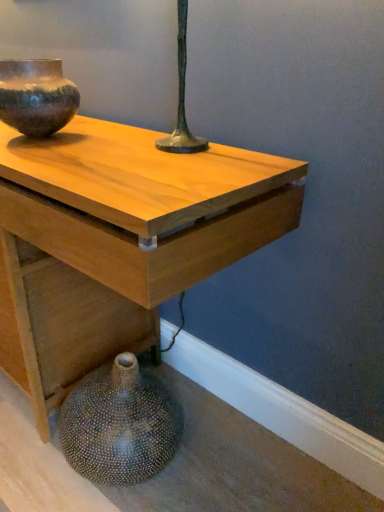
You are a GUI agent. You are given a task and a screenshot of the screen. Output one action in this format:
    pyautogui.click(x=<x>, y=<y>)
    Task: Click on the speckled ceramic vase at lower left, which is the 2th vase from top to bottom
    The image size is (384, 512).
    Given the screenshot: What is the action you would take?
    pyautogui.click(x=120, y=424)

From the image's perspective, is rustic ceramic vase at upper left, positioned as the 1th vase in top-to-bottom order, located above speckled ceramic vase at lower left, the first vase when ordered from bottom to top?

Yes, from the image's perspective, rustic ceramic vase at upper left, positioned as the 1th vase in top-to-bottom order, is above speckled ceramic vase at lower left, the first vase when ordered from bottom to top.

Is rustic ceramic vase at upper left, positioned as the 1th vase in top-to-bottom order, next to speckled ceramic vase at lower left, the first vase when ordered from bottom to top, and touching it?

No, rustic ceramic vase at upper left, positioned as the 1th vase in top-to-bottom order, is not in contact with speckled ceramic vase at lower left, the first vase when ordered from bottom to top.

Which of these two, rustic ceramic vase at upper left, positioned as the 1th vase in top-to-bottom order, or speckled ceramic vase at lower left, which is the 2th vase from top to bottom, is smaller?

rustic ceramic vase at upper left, positioned as the 1th vase in top-to-bottom order, is smaller.

Considering the relative sizes of speckled ceramic vase at lower left, which is the 2th vase from top to bottom, and rustic ceramic vase at upper left, positioned as the 1th vase in top-to-bottom order, in the image provided, is speckled ceramic vase at lower left, which is the 2th vase from top to bottom, bigger than rustic ceramic vase at upper left, positioned as the 1th vase in top-to-bottom order,?

Correct, speckled ceramic vase at lower left, which is the 2th vase from top to bottom, is larger in size than rustic ceramic vase at upper left, positioned as the 1th vase in top-to-bottom order.

Is speckled ceramic vase at lower left, which is the 2th vase from top to bottom, next to rustic ceramic vase at upper left, positioned as the 1th vase in top-to-bottom order?

No, speckled ceramic vase at lower left, which is the 2th vase from top to bottom, is not beside rustic ceramic vase at upper left, positioned as the 1th vase in top-to-bottom order.

Does speckled ceramic vase at lower left, the first vase when ordered from bottom to top, have a greater height compared to rustic ceramic vase at upper left, positioned as the 1th vase in top-to-bottom order?

Indeed, speckled ceramic vase at lower left, the first vase when ordered from bottom to top, has a greater height compared to rustic ceramic vase at upper left, positioned as the 1th vase in top-to-bottom order.

From a real-world perspective, relative to rustic ceramic vase at upper left, marked as the second vase in a bottom-to-top arrangement, is speckled ceramic vase at lower left, which is the 2th vase from top to bottom, vertically above or below?

From a real-world perspective, speckled ceramic vase at lower left, which is the 2th vase from top to bottom, is physically below rustic ceramic vase at upper left, marked as the second vase in a bottom-to-top arrangement.

Where is `the 1st vase counting from the right of the light wood table at center`? the 1st vase counting from the right of the light wood table at center is located at coordinates (36, 96).

From a real-world perspective, is light wood table at center positioned under rustic ceramic vase at upper left, positioned as the 1th vase in top-to-bottom order, based on gravity?

Yes, from a real-world perspective, light wood table at center is beneath rustic ceramic vase at upper left, positioned as the 1th vase in top-to-bottom order.

Based on their positions, is light wood table at center located to the left or right of rustic ceramic vase at upper left, positioned as the 1th vase in top-to-bottom order?

light wood table at center is to the left of rustic ceramic vase at upper left, positioned as the 1th vase in top-to-bottom order.

Does point (96, 353) lie in front of point (19, 126)?

No, (96, 353) is behind (19, 126).

Do you think rustic ceramic vase at upper left, positioned as the 1th vase in top-to-bottom order, is within light wood table at center, or outside of it?

rustic ceramic vase at upper left, positioned as the 1th vase in top-to-bottom order, is outside light wood table at center.

Based on the photo, from the image's perspective, is rustic ceramic vase at upper left, positioned as the 1th vase in top-to-bottom order, positioned above or below light wood table at center?

rustic ceramic vase at upper left, positioned as the 1th vase in top-to-bottom order, is above light wood table at center.

Which object is positioned more to the right, rustic ceramic vase at upper left, positioned as the 1th vase in top-to-bottom order, or light wood table at center?

Positioned to the right is rustic ceramic vase at upper left, positioned as the 1th vase in top-to-bottom order.

Between rustic ceramic vase at upper left, marked as the second vase in a bottom-to-top arrangement, and light wood table at center, which one has larger width?

Wider between the two is light wood table at center.

Consider the image. From the image's perspective, is light wood table at center below speckled ceramic vase at lower left, the first vase when ordered from bottom to top?

Actually, light wood table at center appears above speckled ceramic vase at lower left, the first vase when ordered from bottom to top, in the image.

Considering the sizes of objects light wood table at center and speckled ceramic vase at lower left, which is the 2th vase from top to bottom, in the image provided, who is smaller, light wood table at center or speckled ceramic vase at lower left, which is the 2th vase from top to bottom,?

Smaller between the two is speckled ceramic vase at lower left, which is the 2th vase from top to bottom.

Would you say light wood table at center is inside or outside speckled ceramic vase at lower left, the first vase when ordered from bottom to top?

light wood table at center is outside speckled ceramic vase at lower left, the first vase when ordered from bottom to top.

From the image's perspective, is speckled ceramic vase at lower left, which is the 2th vase from top to bottom, located above or below light wood table at center?

Based on their image positions, speckled ceramic vase at lower left, which is the 2th vase from top to bottom, is located beneath light wood table at center.

This screenshot has width=384, height=512. Identify the location of the 1st vase behind the light wood table at center, counting from the anchor's position. (120, 424).

Would you say speckled ceramic vase at lower left, the first vase when ordered from bottom to top, is to the left or to the right of light wood table at center in the picture?

From the image, it's evident that speckled ceramic vase at lower left, the first vase when ordered from bottom to top, is to the right of light wood table at center.

Considering the sizes of objects speckled ceramic vase at lower left, which is the 2th vase from top to bottom, and light wood table at center in the image provided, who is shorter, speckled ceramic vase at lower left, which is the 2th vase from top to bottom, or light wood table at center?

Standing shorter between the two is speckled ceramic vase at lower left, which is the 2th vase from top to bottom.

Find the location of a particular element. vase above the speckled ceramic vase at lower left, the first vase when ordered from bottom to top (from the image's perspective) is located at coordinates (36, 96).

This screenshot has width=384, height=512. What are the coordinates of `vase to the right of rustic ceramic vase at upper left, positioned as the 1th vase in top-to-bottom order` in the screenshot? It's located at (120, 424).

From the image, which object appears to be farther from speckled ceramic vase at lower left, the first vase when ordered from bottom to top, light wood table at center or rustic ceramic vase at upper left, marked as the second vase in a bottom-to-top arrangement?

rustic ceramic vase at upper left, marked as the second vase in a bottom-to-top arrangement, is positioned further to the anchor speckled ceramic vase at lower left, the first vase when ordered from bottom to top.

Based on their spatial positions, is rustic ceramic vase at upper left, positioned as the 1th vase in top-to-bottom order, or light wood table at center closer to speckled ceramic vase at lower left, which is the 2th vase from top to bottom?

Among the two, light wood table at center is located nearer to speckled ceramic vase at lower left, which is the 2th vase from top to bottom.

Considering their positions, is speckled ceramic vase at lower left, which is the 2th vase from top to bottom, positioned further to light wood table at center than rustic ceramic vase at upper left, positioned as the 1th vase in top-to-bottom order?

rustic ceramic vase at upper left, positioned as the 1th vase in top-to-bottom order.

Estimate the real-world distances between objects in this image. Which object is further from rustic ceramic vase at upper left, marked as the second vase in a bottom-to-top arrangement, light wood table at center or speckled ceramic vase at lower left, which is the 2th vase from top to bottom?

speckled ceramic vase at lower left, which is the 2th vase from top to bottom.

When comparing their distances from light wood table at center, does rustic ceramic vase at upper left, positioned as the 1th vase in top-to-bottom order, or speckled ceramic vase at lower left, which is the 2th vase from top to bottom, seem further?

rustic ceramic vase at upper left, positioned as the 1th vase in top-to-bottom order, is positioned further to the anchor light wood table at center.

Considering their positions, is speckled ceramic vase at lower left, which is the 2th vase from top to bottom, positioned further to rustic ceramic vase at upper left, positioned as the 1th vase in top-to-bottom order, than light wood table at center?

Based on the image, speckled ceramic vase at lower left, which is the 2th vase from top to bottom, appears to be further to rustic ceramic vase at upper left, positioned as the 1th vase in top-to-bottom order.

This screenshot has height=512, width=384. I want to click on table between rustic ceramic vase at upper left, positioned as the 1th vase in top-to-bottom order, and speckled ceramic vase at lower left, the first vase when ordered from bottom to top, in the up-down direction, so click(x=122, y=238).